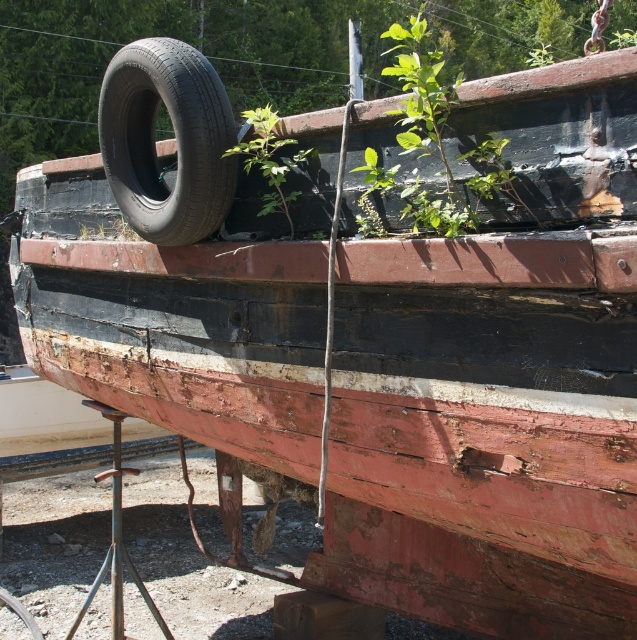
You are a maintenance worker assessing the boat. You notice the black rubber tire at upper left and the green leafy plant at center. Which object is taller?

The green leafy plant at center is taller than the black rubber tire at upper left.

From the picture: You are a botanist examining the green leafy plant at upper center in the image. What are the coordinates of its location?

The green leafy plant at upper center is located at coordinates point (440, 140).

You are a mechanic inspecting the boat and need to place a new tool kit on the deck near the black rubber tire at upper left. Based on the coordinates provided, where should you place the tool kit relative to the tire?

The black rubber tire at upper left is located at point (175, 140), so you should place the tool kit near those coordinates on the deck.